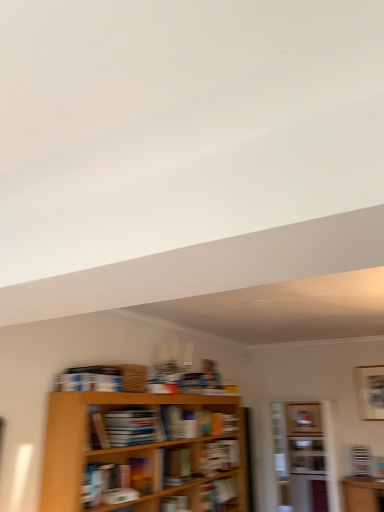
Measure the distance between point (162, 505) and camera.

Point (162, 505) and camera are 3.26 meters apart.

At what (x,y) coordinates should I click in order to perform the action: click on white glossy cabinet at center. Please return your answer as a coordinate pair (x, y). The width and height of the screenshot is (384, 512). Looking at the image, I should click on (306, 454).

What do you see at coordinates (219, 456) in the screenshot? This screenshot has height=512, width=384. I see `white matte bookshelf at center, which appears as the 3th book when viewed from the right` at bounding box center [219, 456].

In order to face matte black bookshelf at lower right, the first book from the back, should I rotate leftwards or rightwards?

You should rotate right by 21.885 degrees.

The image size is (384, 512). Describe the element at coordinates (218, 495) in the screenshot. I see `hardcover book at center, which appears as the 5th book when viewed from the left` at that location.

Consider the image. Measure the distance between point (215, 500) and camera.

Point (215, 500) and camera are 3.90 meters apart from each other.

This screenshot has height=512, width=384. What do you see at coordinates (122, 426) in the screenshot?
I see `hardcover book at center, which is the 1th book from left to right` at bounding box center [122, 426].

This screenshot has width=384, height=512. Find the location of `hardcover book at center, the 2th book from the front`. hardcover book at center, the 2th book from the front is located at coordinates (175, 504).

Is point (222, 502) closer or farther from the camera than point (323, 451)?

Point (222, 502) appears to be closer to the viewer than point (323, 451).

Is hardcover book at center, which is the fourth book from front to back, oriented away from white glossy cabinet at center?

hardcover book at center, which is the fourth book from front to back, is not turned away from white glossy cabinet at center.

Does hardcover book at center, which is the fourth book from front to back, appear on the left side of white glossy cabinet at center?

Indeed, hardcover book at center, which is the fourth book from front to back, is positioned on the left side of white glossy cabinet at center.

From the image's perspective, which one is positioned lower, hardcover book at center, which is the fourth book from front to back, or white glossy cabinet at center?

white glossy cabinet at center appears lower in the image.

Which is more to the left, hardcover book at center, positioned as the 2th book in left-to-right order, or wooden bookshelf at center?

From the viewer's perspective, hardcover book at center, positioned as the 2th book in left-to-right order, appears more on the left side.

Which of these two, hardcover book at center, which is counted as the 5th book, starting from the right, or wooden bookshelf at center, is bigger?

wooden bookshelf at center is bigger.

In the scene shown: How different are the orientations of hardcover book at center, the 2th book from the front, and wooden bookshelf at center in degrees?

The angle between the facing direction of hardcover book at center, the 2th book from the front, and the facing direction of wooden bookshelf at center is 90.6 degrees.

Are hardcover book at center, positioned as the 2th book in left-to-right order, and wooden bookshelf at center making contact?

They are not placed beside each other.

Does point (212, 458) appear closer or farther from the camera than point (173, 499)?

Point (212, 458) is farther from the camera than point (173, 499).

Choose the correct answer: Is white matte bookshelf at center, the second book in the back-to-front sequence, inside hardcover book at center, the 2th book from the front, or outside it?

white matte bookshelf at center, the second book in the back-to-front sequence, is spatially situated outside hardcover book at center, the 2th book from the front.

Would you consider white matte bookshelf at center, the second book in the back-to-front sequence, to be distant from hardcover book at center, which is counted as the 5th book, starting from the right?

Actually, white matte bookshelf at center, the second book in the back-to-front sequence, and hardcover book at center, which is counted as the 5th book, starting from the right, are a little close together.

How different are the orientations of white matte bookshelf at center, the 5th book in the front-to-back sequence, and hardcover book at center, positioned as the 2th book in left-to-right order, in degrees?

There is a 0.939-degree angle between the facing directions of white matte bookshelf at center, the 5th book in the front-to-back sequence, and hardcover book at center, positioned as the 2th book in left-to-right order.

Considering the relative positions of white glossy cabinet at center and hardcover book at center, the sixth book viewed from the right, in the image provided, is white glossy cabinet at center behind hardcover book at center, the sixth book viewed from the right,?

That is True.

Can you confirm if white glossy cabinet at center is taller than hardcover book at center, which is the 1th book from left to right?

Indeed, white glossy cabinet at center has a greater height compared to hardcover book at center, which is the 1th book from left to right.

Considering the sizes of objects white glossy cabinet at center and hardcover book at center, which is the 6th book from back to front, in the image provided, who is bigger, white glossy cabinet at center or hardcover book at center, which is the 6th book from back to front,?

hardcover book at center, which is the 6th book from back to front, is bigger.

Does wooden bookshelf at center have a larger size compared to white matte bookshelf at center, which appears as the 3th book when viewed from the right?

Yes.

Visually, is wooden bookshelf at center positioned to the left or to the right of white matte bookshelf at center, the 5th book in the front-to-back sequence?

wooden bookshelf at center is positioned on white matte bookshelf at center, the 5th book in the front-to-back sequence,'s right side.

Does point (330, 472) lie behind point (226, 463)?

Yes.

Looking at this image, in terms of width, does wooden bookshelf at center look wider or thinner when compared to matte brown book at center, which appears as the third book when viewed from the front?

Clearly, wooden bookshelf at center has less width compared to matte brown book at center, which appears as the third book when viewed from the front.

Are wooden bookshelf at center and matte brown book at center, which ranks as the 4th book in back-to-front order, beside each other?

wooden bookshelf at center and matte brown book at center, which ranks as the 4th book in back-to-front order, are clearly separated.

Who is bigger, wooden bookshelf at center or matte brown book at center, the 4th book positioned from the right?

With larger size is wooden bookshelf at center.

Is matte brown book at center, the 4th book positioned from the right, inside wooden bookshelf at center?

No, matte brown book at center, the 4th book positioned from the right, is located outside of wooden bookshelf at center.

Is point (363, 450) closer or farther from the camera than point (104, 413)?

Clearly, point (363, 450) is more distant from the camera than point (104, 413).

Is matte black bookshelf at lower right, the first book from the back, to the right of hardcover book at center, which is the 1th book from left to right, from the viewer's perspective?

Yes.

Considering the relative positions of matte black bookshelf at lower right, the first book from the back, and hardcover book at center, the sixth book viewed from the right, in the image provided, is matte black bookshelf at lower right, the first book from the back, in front of hardcover book at center, the sixth book viewed from the right,?

No, matte black bookshelf at lower right, the first book from the back, is further to the viewer.

Can you confirm if matte black bookshelf at lower right, which appears as the 6th book when viewed from the front, is thinner than hardcover book at center, arranged as the first book when viewed from the front?

Indeed, matte black bookshelf at lower right, which appears as the 6th book when viewed from the front, has a lesser width compared to hardcover book at center, arranged as the first book when viewed from the front.

Which book is the 3rd one when counting from the front of the white glossy cabinet at center? Please provide its 2D coordinates.

[(218, 495)]

At what (x,y) coordinates should I click in order to perform the action: click on book that is the 2nd one below the wooden bookshelf at center (from a real-world perspective). Please return your answer as a coordinate pair (x, y). This screenshot has height=512, width=384. Looking at the image, I should click on 175,504.

Looking at the image, which one is located closer to hardcover book at center, arranged as the fifth book when viewed from the back, hardcover book at center, which is the 6th book from back to front, or hardcover book at center, which ranks as the 2th book in right-to-left order?

hardcover book at center, which ranks as the 2th book in right-to-left order, lies closer to hardcover book at center, arranged as the fifth book when viewed from the back, than the other object.

Considering their positions, is white glossy cabinet at center positioned closer to matte black bookshelf at lower right, the 1th book viewed from the right, than wooden bookshelf at center?

white glossy cabinet at center is closer to matte black bookshelf at lower right, the 1th book viewed from the right.

From the image, which object appears to be farther from wooden bookshelf at center, matte black bookshelf at lower right, which is counted as the sixth book, starting from the left, or hardcover book at center, placed as the 3th book when sorted from back to front?

The object further to wooden bookshelf at center is hardcover book at center, placed as the 3th book when sorted from back to front.

Looking at the image, which one is located further to wooden bookshelf at center, matte black bookshelf at lower right, which appears as the 6th book when viewed from the front, or white glossy cabinet at center?

The object further to wooden bookshelf at center is matte black bookshelf at lower right, which appears as the 6th book when viewed from the front.

When comparing their distances from white matte bookshelf at center, the 5th book in the front-to-back sequence, does hardcover book at center, the 2th book from the front, or matte black bookshelf at lower right, which appears as the 6th book when viewed from the front, seem closer?

hardcover book at center, the 2th book from the front, lies closer to white matte bookshelf at center, the 5th book in the front-to-back sequence, than the other object.

Looking at the image, which one is located closer to wooden bookshelf at center, hardcover book at center, which ranks as the 2th book in right-to-left order, or hardcover book at center, which is the 6th book from back to front?

Based on the image, hardcover book at center, which ranks as the 2th book in right-to-left order, appears to be nearer to wooden bookshelf at center.

Based on their spatial positions, is hardcover book at center, which is the 6th book from back to front, or white glossy cabinet at center further from white matte bookshelf at center, the 5th book in the front-to-back sequence?

white glossy cabinet at center lies further to white matte bookshelf at center, the 5th book in the front-to-back sequence, than the other object.

When comparing their distances from wooden bookshelf at center, does hardcover book at center, which is the 6th book from back to front, or matte brown book at center, which ranks as the 4th book in back-to-front order, seem further?

hardcover book at center, which is the 6th book from back to front.

This screenshot has width=384, height=512. I want to click on shelf situated between hardcover book at center, positioned as the 2th book in left-to-right order, and matte black bookshelf at lower right, which appears as the 6th book when viewed from the front, from left to right, so click(x=305, y=457).

Locate an element on the screen. Image resolution: width=384 pixels, height=512 pixels. book positioned between white matte bookshelf at center, the 5th book in the front-to-back sequence, and white glossy cabinet at center from near to far is located at coordinates (361, 461).

The width and height of the screenshot is (384, 512). Identify the location of shelf between hardcover book at center, arranged as the fifth book when viewed from the back, and white glossy cabinet at center in the front-back direction. (305, 457).

Where is `book located between hardcover book at center, the 2th book from the front, and hardcover book at center, which is the fourth book from front to back, in the depth direction`? book located between hardcover book at center, the 2th book from the front, and hardcover book at center, which is the fourth book from front to back, in the depth direction is located at coordinates (177, 467).